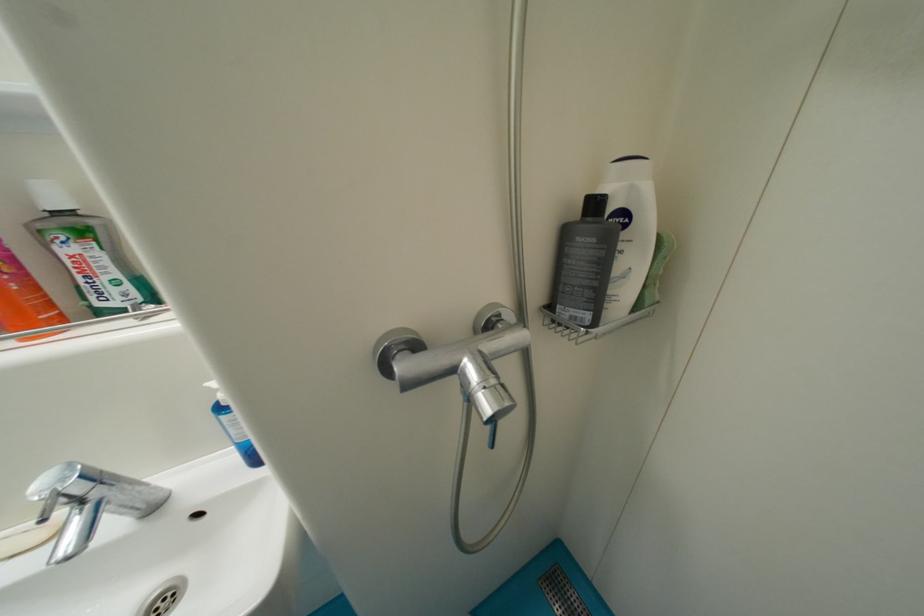
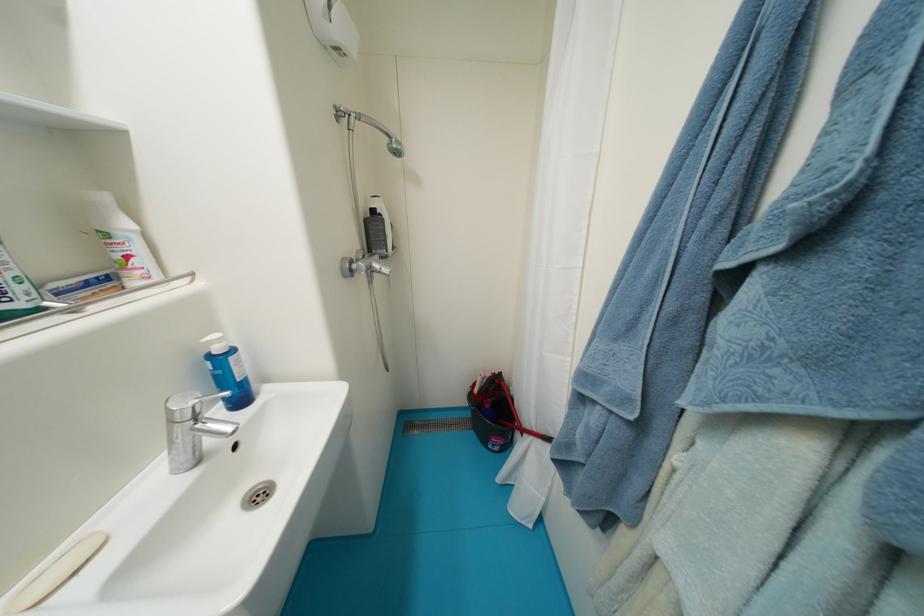
Where in the second image is the point corresponding to [601,206] from the first image?

(380, 214)